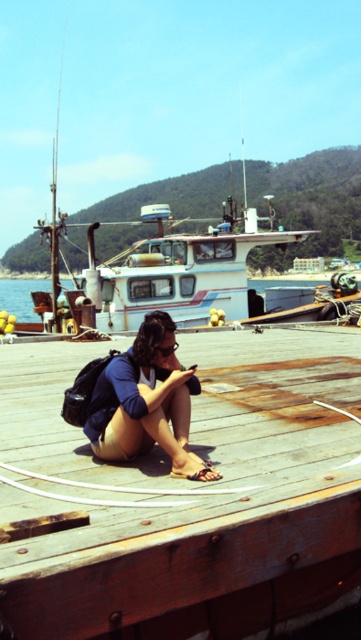
You are a photographer standing on the wooden dock. You want to capture a photo of the wooden at center and the clear blue water at lower left. Which object will appear closer to the bottom edge of your photo?

The clear blue water at lower left will appear closer to the bottom edge of the photo because it is positioned below the wooden at center.

You are standing on the dock and want to place a small item exactly where the wooden at center is located. What are the coordinates where you should place it?

The coordinates for the wooden at center are at point (185, 497).